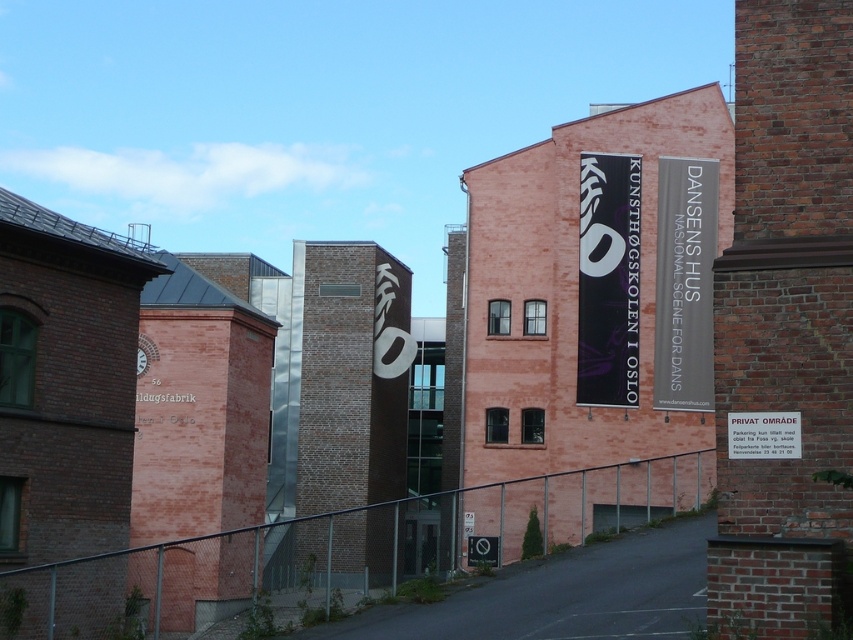
Image resolution: width=853 pixels, height=640 pixels. Identify the location of black matte banner at center. (608, 280).

Which is in front, point (601, 260) or point (676, 196)?

Point (601, 260) is in front.

Is point (579, 273) positioned in front of point (679, 221)?

Yes.

Find the location of a particular element. black matte banner at center is located at coordinates (608, 280).

Is white fabric banner at center-right positioned in front of white plastic sign at lower center?

No, white fabric banner at center-right is behind white plastic sign at lower center.

Measure the distance between white fabric banner at center-right and camera.

white fabric banner at center-right and camera are 57.16 meters apart.

You are a GUI agent. You are given a task and a screenshot of the screen. Output one action in this format:
    pyautogui.click(x=<x>, y=<y>)
    Task: Click on the white fabric banner at center-right
    This screenshot has width=853, height=640.
    Given the screenshot: What is the action you would take?
    pyautogui.click(x=683, y=284)

You are a GUI agent. You are given a task and a screenshot of the screen. Output one action in this format:
    pyautogui.click(x=<x>, y=<y>)
    Task: Click on the white fabric banner at center-right
    The height and width of the screenshot is (640, 853).
    Given the screenshot: What is the action you would take?
    pyautogui.click(x=683, y=284)

Does white paper sign at center right appear under white plastic sign at lower center?

No.

Is white paper sign at center right to the left of white plastic sign at lower center from the viewer's perspective?

In fact, white paper sign at center right is to the right of white plastic sign at lower center.

Who is more distant from viewer, (727, 449) or (479, 560)?

Point (479, 560)

At what (x,y) coordinates should I click in order to perform the action: click on white paper sign at center right. Please return your answer as a coordinate pair (x, y). Looking at the image, I should click on (763, 435).